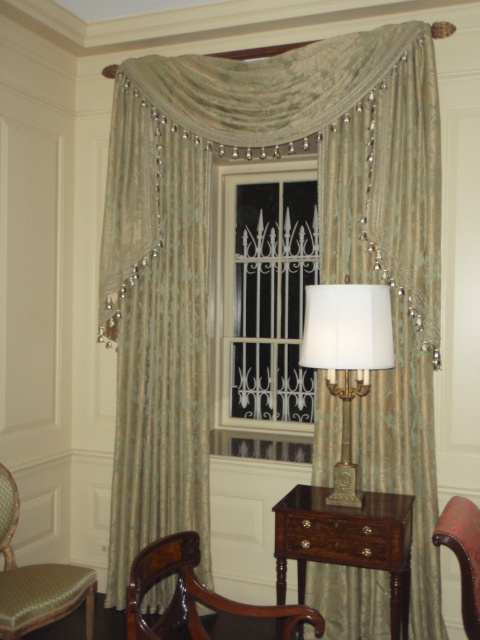
Question: Which of the following is the closest to the observer?

Choices:
 (A) (310, 285)
 (B) (165, 548)
 (C) (250, 232)
 (D) (409, 547)

Answer: (B)

Question: In this image, where is white fabric lampshade at center located relative to mahogany wood armchair at lower left?

Choices:
 (A) right
 (B) left

Answer: (A)

Question: Among these points, which one is farthest from the camera?

Choices:
 (A) (315, 333)
 (B) (381, 540)
 (C) (60, 614)
 (D) (187, 552)

Answer: (A)

Question: Is green textured curtains at center closer to the viewer compared to white fabric lampshade at center?

Choices:
 (A) yes
 (B) no

Answer: (B)

Question: Which object is the farthest from the white metal bars at center?

Choices:
 (A) mahogany drawer at center
 (B) green textured curtains at center
 (C) white fabric lampshade at center
 (D) leather armchair at center

Answer: (D)

Question: From the image, what is the correct spatial relationship of green textured curtains at center in relation to mahogany wood armchair at lower left?

Choices:
 (A) above
 (B) below

Answer: (A)